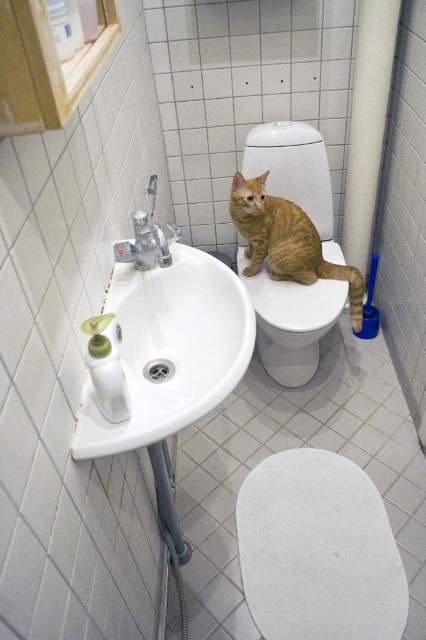
Does orange tabby cat at center have a smaller size compared to satin nickel faucet at sink left?

Actually, orange tabby cat at center might be larger than satin nickel faucet at sink left.

Is orange tabby cat at center taller than satin nickel faucet at sink left?

Yes.

Does point (255, 205) come closer to viewer compared to point (143, 230)?

No, (255, 205) is behind (143, 230).

Where is `orange tabby cat at center`? The height and width of the screenshot is (640, 426). orange tabby cat at center is located at coordinates (287, 241).

Is white matte toilet seat at center behind orange tabby cat at center?

No, it is not.

Who is higher up, white matte toilet seat at center or orange tabby cat at center?

orange tabby cat at center is above.

Between point (302, 515) and point (305, 266), which one is positioned in front?

Point (302, 515)

You are a GUI agent. You are given a task and a screenshot of the screen. Output one action in this format:
    pyautogui.click(x=<x>, y=<y>)
    Task: Click on the white matte toilet seat at center
    Image resolution: width=426 pixels, height=640 pixels.
    Given the screenshot: What is the action you would take?
    (x=317, y=550)

Consider the image. Does white matte toilet seat at center have a greater width compared to white glossy sink at lower left?

Correct, the width of white matte toilet seat at center exceeds that of white glossy sink at lower left.

Is point (367, 545) farther from camera compared to point (224, 397)?

That is True.

Between point (299, 490) and point (183, 324), which one is positioned in front?

Point (183, 324)

Identify the location of white matte toilet seat at center. (317, 550).